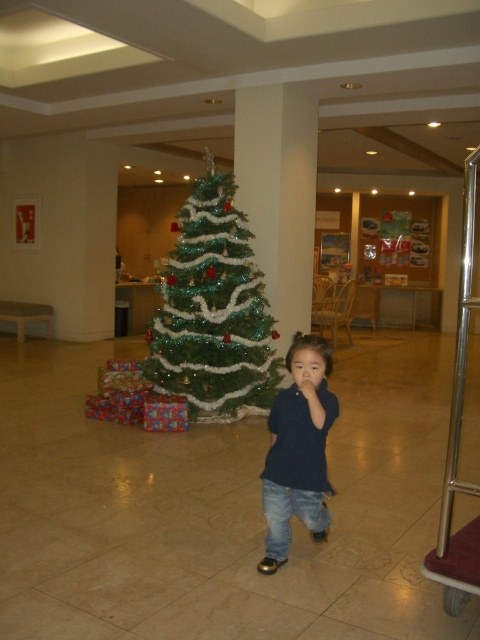
Question: Is green shiny christmas tree at center positioned before dark blue shirt at center?

Choices:
 (A) yes
 (B) no

Answer: (B)

Question: Can you confirm if green shiny christmas tree at center is smaller than dark blue shirt at center?

Choices:
 (A) yes
 (B) no

Answer: (B)

Question: Which of the following is the farthest from the observer?

Choices:
 (A) (320, 512)
 (B) (232, 342)

Answer: (B)

Question: Which point appears closest to the camera in this image?

Choices:
 (A) (245, 332)
 (B) (268, 554)

Answer: (B)

Question: Can you confirm if green shiny christmas tree at center is positioned above dark blue shirt at center?

Choices:
 (A) yes
 (B) no

Answer: (A)